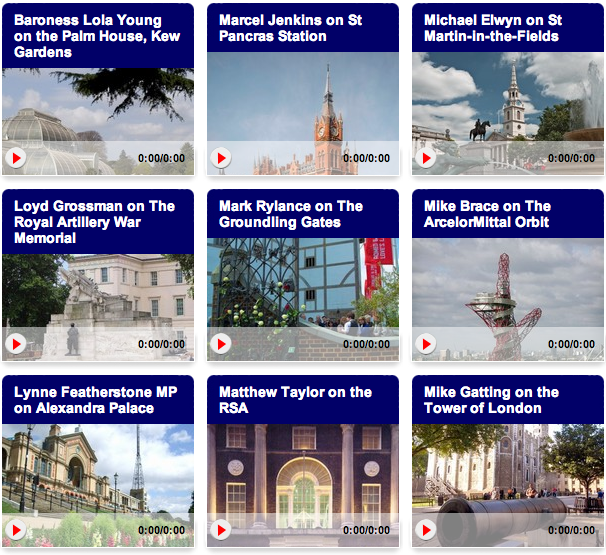
Find the location of a particular element. columns is located at coordinates (259, 478), (345, 466), (211, 503), (391, 478), (499, 155).